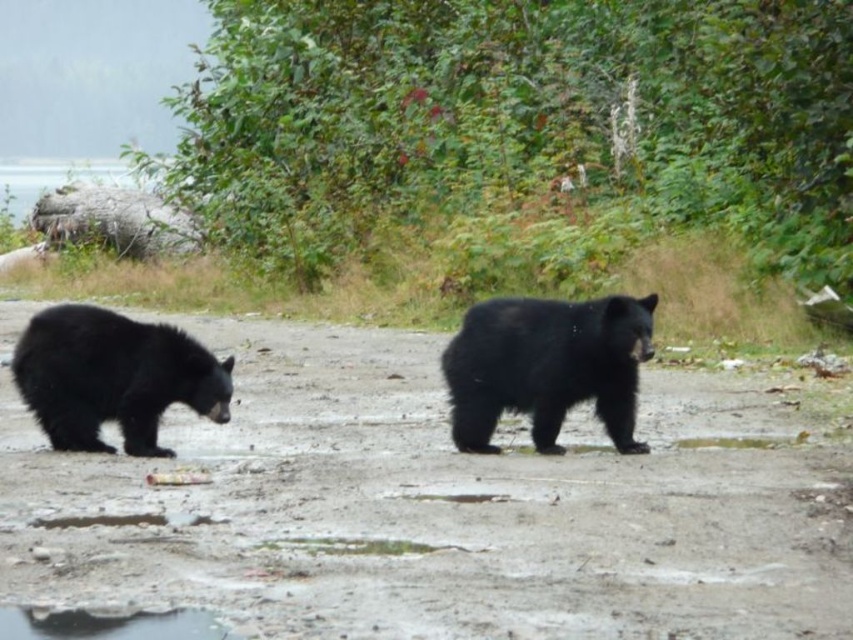
Between black furry bear at center and black furry bear at left, which one appears on the right side from the viewer's perspective?

Positioned to the right is black furry bear at center.

Does black furry bear at center have a greater width compared to black furry bear at left?

Incorrect, black furry bear at center's width does not surpass black furry bear at left's.

Is point (489, 388) farther from viewer compared to point (19, 381)?

No, it is in front of (19, 381).

Identify the location of black furry bear at center. This screenshot has height=640, width=853. (547, 365).